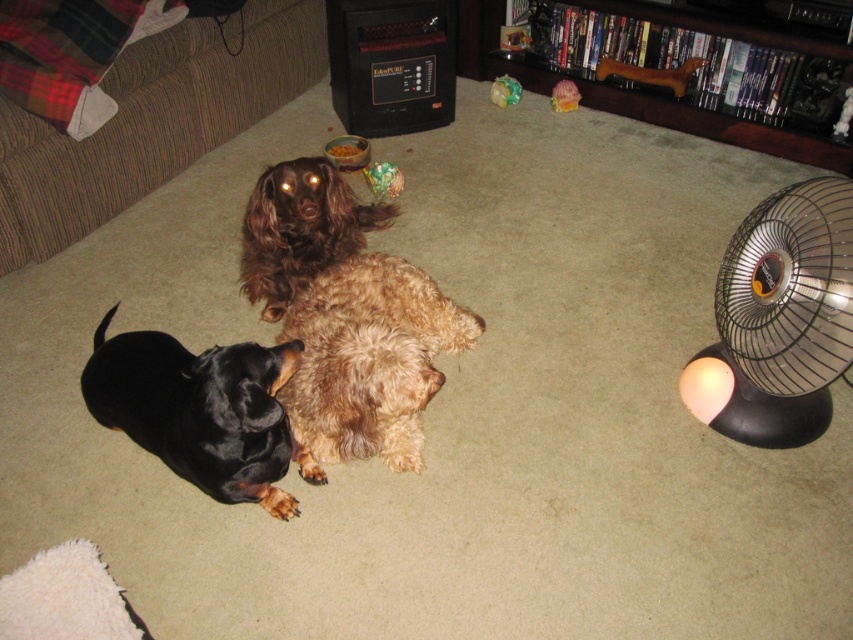
Which of these two, brown fluffy dog at center or plush multicolored toy at center, stands taller?

brown fluffy dog at center is taller.

The height and width of the screenshot is (640, 853). In order to click on brown fluffy dog at center in this screenshot , I will do `click(300, 228)`.

From the picture: Which is more to the right, brown fabric couch at upper left or brown fluffy dog at center?

brown fluffy dog at center

Does brown fabric couch at upper left come in front of brown fluffy dog at center?

No, brown fabric couch at upper left is behind brown fluffy dog at center.

Is point (33, 140) farther from camera compared to point (299, 243)?

Yes, point (33, 140) is behind point (299, 243).

Find the location of a particular element. This screenshot has width=853, height=640. brown fabric couch at upper left is located at coordinates (151, 122).

Is point (775, 294) closer to camera compared to point (428, 385)?

No, it is behind (428, 385).

Does black plastic fan at right appear over fuzzy brown dog at center?

Correct, black plastic fan at right is located above fuzzy brown dog at center.

Describe the element at coordinates (779, 320) in the screenshot. This screenshot has height=640, width=853. I see `black plastic fan at right` at that location.

Where is `black plastic fan at right`? black plastic fan at right is located at coordinates (779, 320).